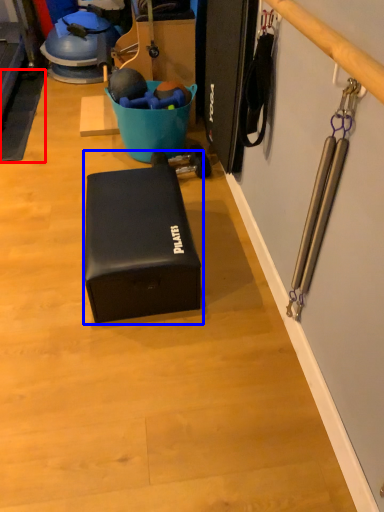
Question: Which object is further to the camera taking this photo, yoga mat (highlighted by a red box) or box (highlighted by a blue box)?

Choices:
 (A) yoga mat
 (B) box

Answer: (A)